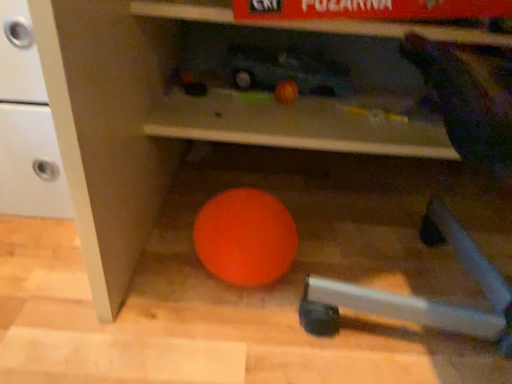
Question: Considering the positions of orange rubber ball at center and orange matte bean bag chair at lower left in the image, is orange rubber ball at center taller or shorter than orange matte bean bag chair at lower left?

Choices:
 (A) short
 (B) tall

Answer: (A)

Question: Considering their positions, is orange rubber ball at center located in front of or behind orange matte bean bag chair at lower left?

Choices:
 (A) behind
 (B) front

Answer: (A)

Question: Is orange rubber ball at center bigger or smaller than orange matte bean bag chair at lower left?

Choices:
 (A) small
 (B) big

Answer: (A)

Question: From the image's perspective, is orange matte bean bag chair at lower left above or below orange rubber ball at center?

Choices:
 (A) below
 (B) above

Answer: (B)

Question: Considering the positions of orange matte bean bag chair at lower left and orange rubber ball at center in the image, is orange matte bean bag chair at lower left bigger or smaller than orange rubber ball at center?

Choices:
 (A) big
 (B) small

Answer: (A)

Question: In the image, is orange matte bean bag chair at lower left positioned in front of or behind orange rubber ball at center?

Choices:
 (A) front
 (B) behind

Answer: (A)

Question: Is orange matte bean bag chair at lower left spatially inside orange rubber ball at center, or outside of it?

Choices:
 (A) inside
 (B) outside

Answer: (B)